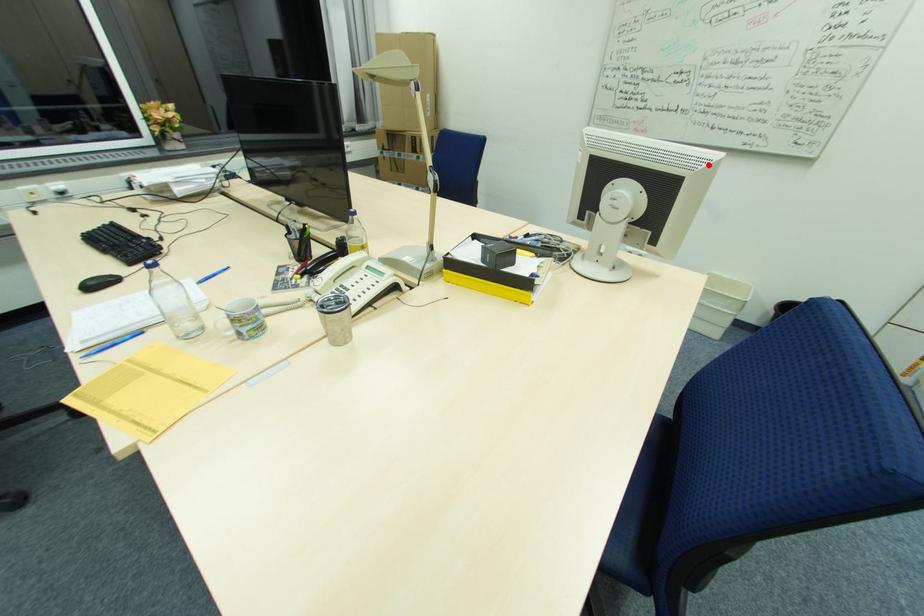
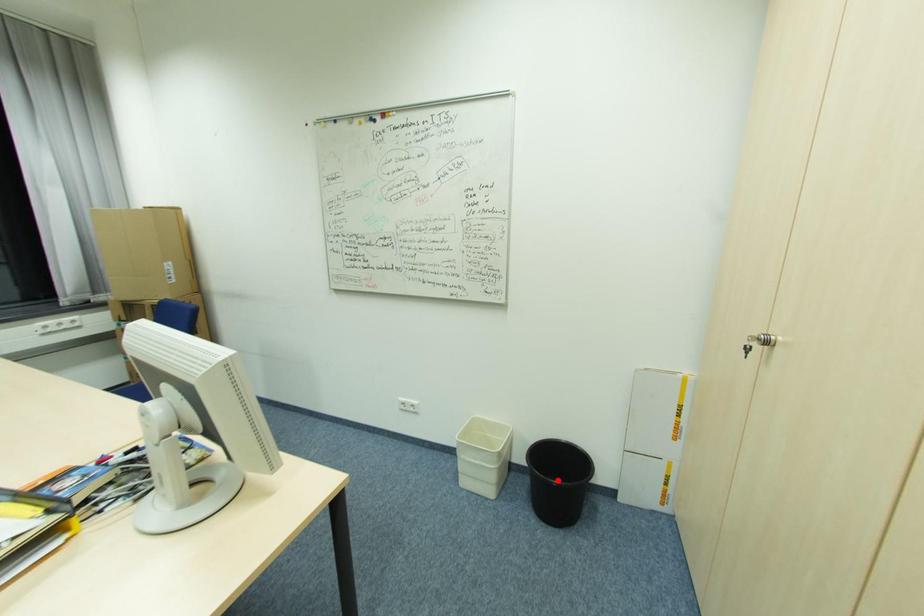
I am providing you with two images of the same scene from different viewpoints. A red point is marked on the first image and another point is marked on the second image. Is the red point in image1 aligned with the point shown in image2?

No